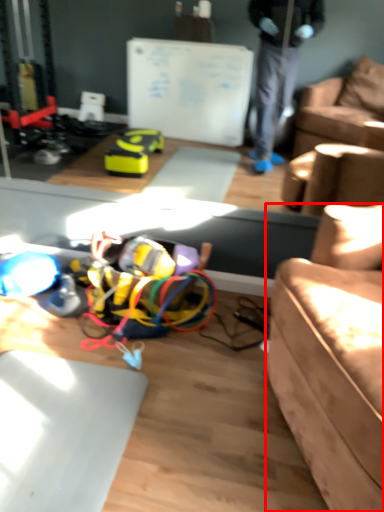
Question: From the image's perspective, where is studio couch (annotated by the red box) located relative to wire?

Choices:
 (A) below
 (B) above

Answer: (A)